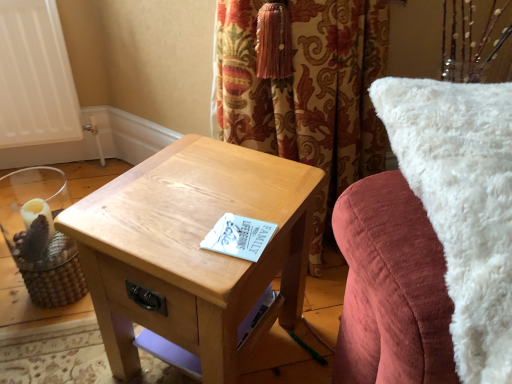
Question: Is light brown wood table at center positioned far away from woven wood candle holder at left?

Choices:
 (A) no
 (B) yes

Answer: (A)

Question: Does light brown wood table at center have a lesser height compared to woven wood candle holder at left?

Choices:
 (A) no
 (B) yes

Answer: (A)

Question: Does light brown wood table at center have a greater height compared to woven wood candle holder at left?

Choices:
 (A) no
 (B) yes

Answer: (B)

Question: Can you confirm if light brown wood table at center is thinner than woven wood candle holder at left?

Choices:
 (A) no
 (B) yes

Answer: (A)

Question: Could you tell me if light brown wood table at center is turned towards woven wood candle holder at left?

Choices:
 (A) yes
 (B) no

Answer: (B)

Question: Is light brown wood table at center smaller than woven wood candle holder at left?

Choices:
 (A) no
 (B) yes

Answer: (A)

Question: From a real-world perspective, is woven wood candle holder at left over white fluffy pillow at upper right?

Choices:
 (A) yes
 (B) no

Answer: (B)

Question: Would you say woven wood candle holder at left contains white fluffy pillow at upper right?

Choices:
 (A) yes
 (B) no

Answer: (B)

Question: Is woven wood candle holder at left next to white fluffy pillow at upper right?

Choices:
 (A) yes
 (B) no

Answer: (B)

Question: Would you consider woven wood candle holder at left to be distant from white fluffy pillow at upper right?

Choices:
 (A) yes
 (B) no

Answer: (B)

Question: Does woven wood candle holder at left have a lesser width compared to white fluffy pillow at upper right?

Choices:
 (A) yes
 (B) no

Answer: (A)

Question: Does woven wood candle holder at left appear on the right side of white fluffy pillow at upper right?

Choices:
 (A) yes
 (B) no

Answer: (B)

Question: Is white fluffy pillow at upper right smaller than woven wood candle holder at left?

Choices:
 (A) yes
 (B) no

Answer: (B)